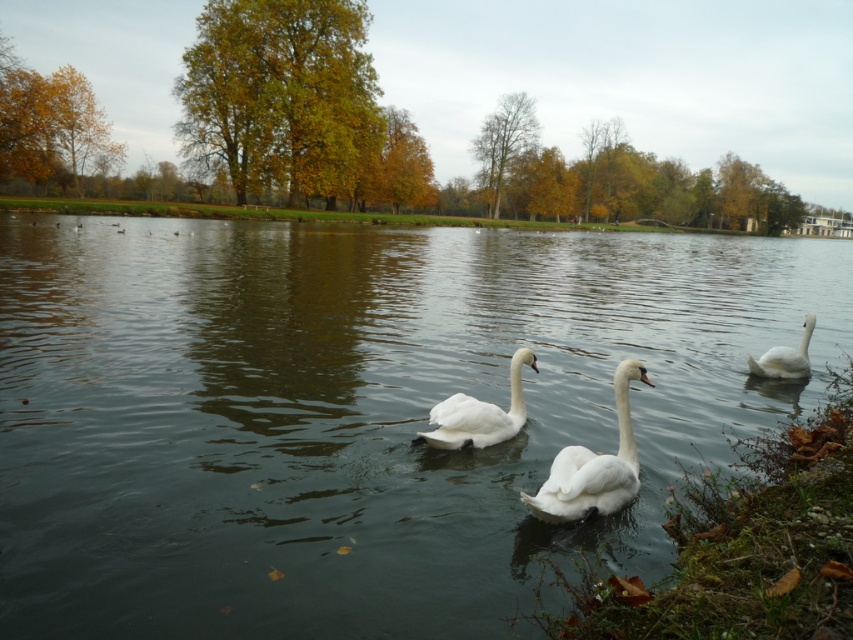
Can you confirm if clear water at center is smaller than white matte swan at center?

Actually, clear water at center might be larger than white matte swan at center.

Is clear water at center bigger than white matte swan at center?

Yes, clear water at center is bigger than white matte swan at center.

At what (x,y) coordinates should I click in order to perform the action: click on clear water at center. Please return your answer as a coordinate pair (x, y). This screenshot has height=640, width=853. Looking at the image, I should click on 357,412.

Find the location of a particular element. The height and width of the screenshot is (640, 853). clear water at center is located at coordinates pos(357,412).

Between clear water at center and white glossy swan at right, which one is positioned lower?

white glossy swan at right

In order to click on clear water at center in this screenshot , I will do `click(357, 412)`.

Between point (514, 424) and point (782, 358), which one is positioned in front?

Point (514, 424) is more forward.

Does point (494, 419) come farther from viewer compared to point (807, 339)?

No, it is in front of (807, 339).

Locate an element on the screen. The width and height of the screenshot is (853, 640). white smooth swan at center is located at coordinates (479, 413).